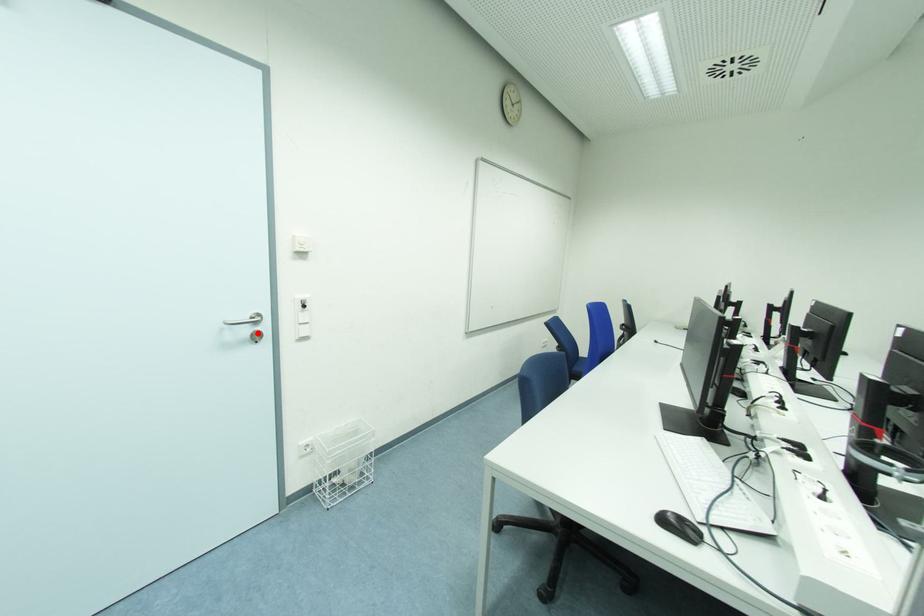
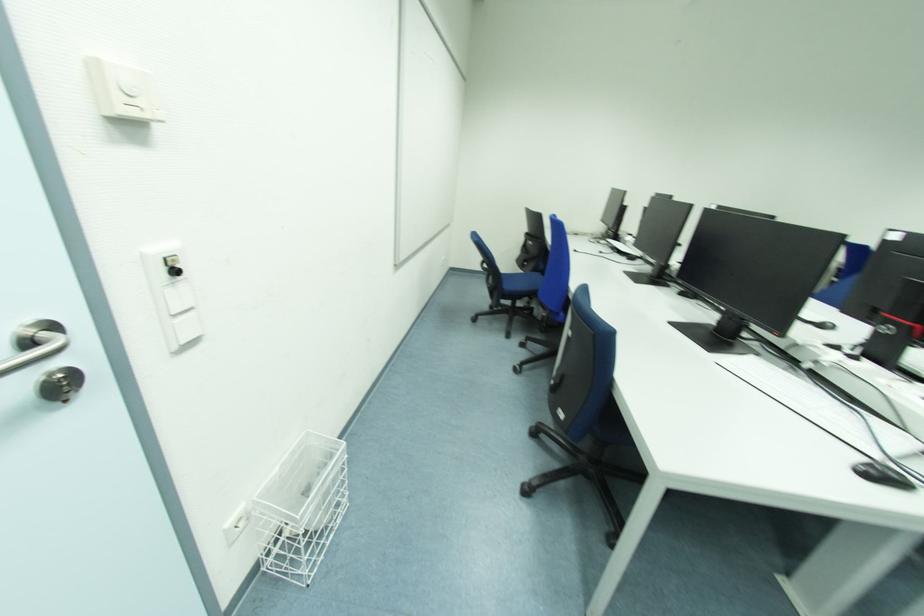
Find the pixel in the second image that matches the highlighted location in the first image.

(55, 375)